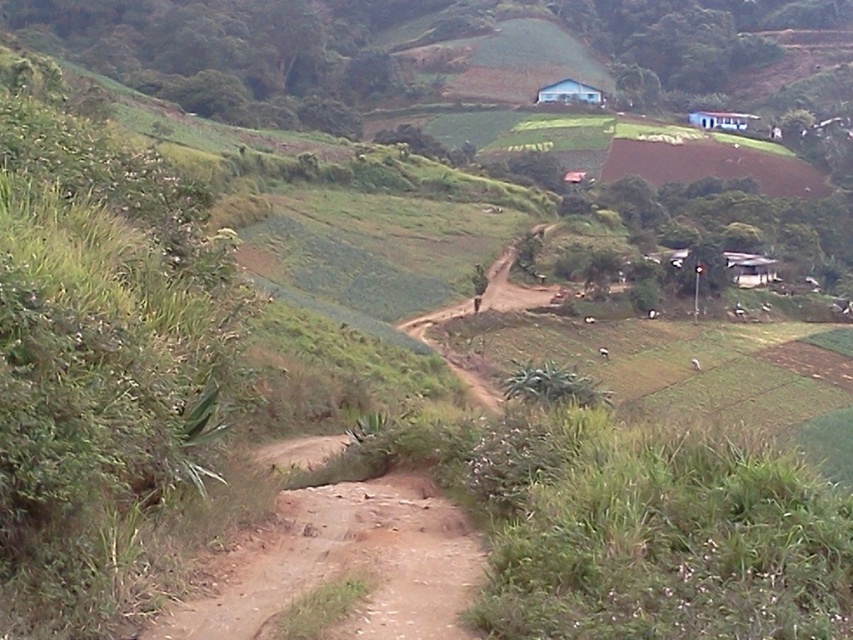
Question: Among these points, which one is nearest to the camera?

Choices:
 (A) (546, 97)
 (B) (728, 122)

Answer: (A)

Question: Does white matte hut at upper center come behind white corrugated metal hut at upper center?

Choices:
 (A) yes
 (B) no

Answer: (B)

Question: Can you confirm if dusty brown dirt track at center is positioned above white corrugated metal hut at upper center?

Choices:
 (A) no
 (B) yes

Answer: (A)

Question: Among these points, which one is farthest from the camera?

Choices:
 (A) (728, 128)
 (B) (538, 93)
 (C) (416, 522)

Answer: (B)

Question: Which of the following is the closest to the observer?

Choices:
 (A) (538, 100)
 (B) (448, 577)

Answer: (B)

Question: Considering the relative positions of white matte hut at upper center and white corrugated metal hut at upper center in the image provided, where is white matte hut at upper center located with respect to white corrugated metal hut at upper center?

Choices:
 (A) right
 (B) left

Answer: (B)